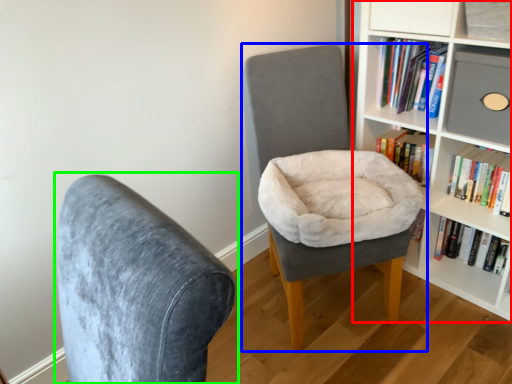
Question: Which object is positioned farthest from bookcase (highlighted by a red box)? Select from chair (highlighted by a blue box) and chair (highlighted by a green box).

Choices:
 (A) chair
 (B) chair

Answer: (B)